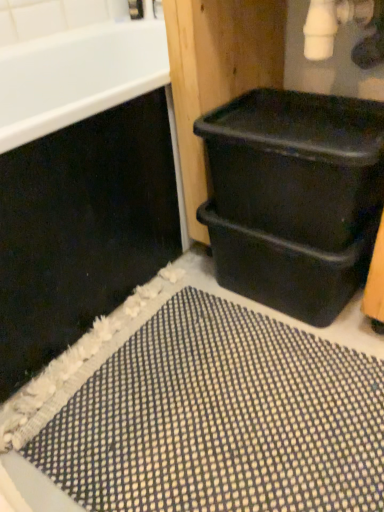
This screenshot has width=384, height=512. Identify the location of empty space that is ontop of black textured bath mat at lower right. (224, 382).